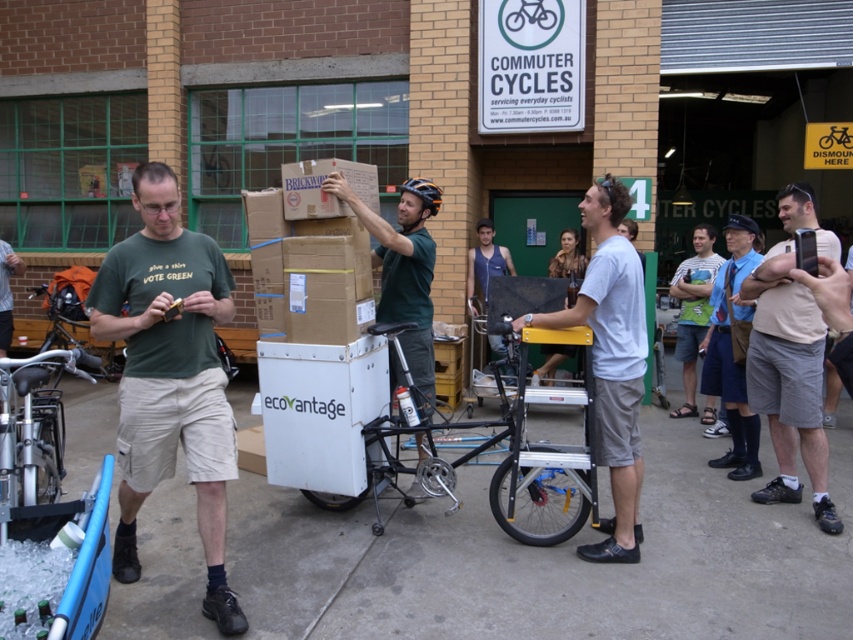
You are a cyclist who just arrived at the Commuter Cycles shop. You see a black matte cargo bike at center and a matte green helmet at center. Which object is located to the right of the other?

The black matte cargo bike at center is positioned on the right side of matte green helmet at center, so the cargo bike is to the right of the helmet.

Based on the photo, you are standing at the DISMOUNT HERE area in front of the COMMUTER CYCLES building. You see two points marked as point 1 at coordinate (633, 472) and point 2 at coordinate (776, 195). Which point is closer to you?

Point 1 at coordinate (633, 472) is closer to you because it is in front of point 2 at coordinate (776, 195).

You are a customer at the COMMUTER CYCLES shop and want to rent a bicycle. The shop has a rule that you must stand at the DISMOUNT HERE area before renting. You are currently at point (610, 360). Is the white matte bicycle at center available for rent?

The white matte bicycle at center is located at point (610, 360), so yes, it is available for rent as it is at the required DISMOUNT HERE area.